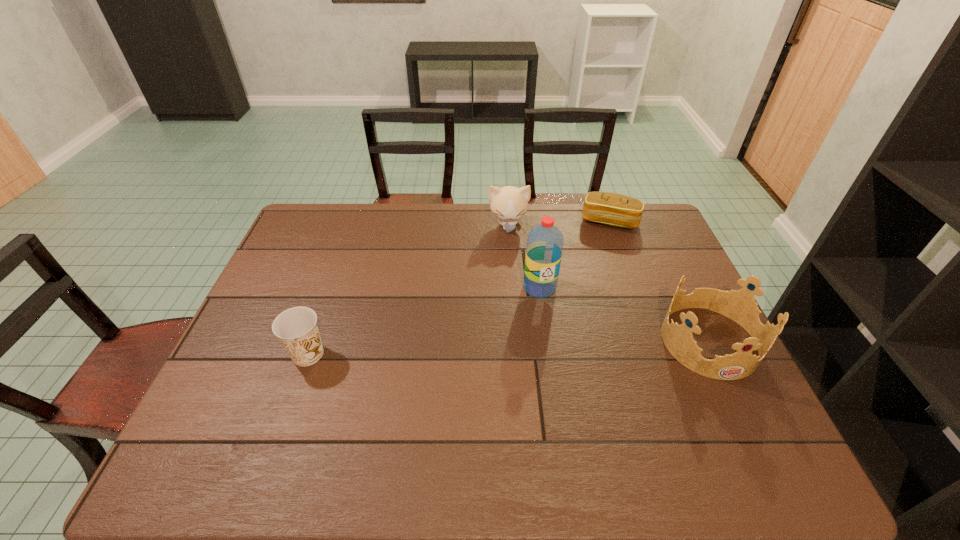
This screenshot has width=960, height=540. I want to click on object that is at the left edge, so click(x=297, y=329).

Where is `tiara present at the right edge`? This screenshot has height=540, width=960. tiara present at the right edge is located at coordinates (740, 306).

Locate an element on the screen. This screenshot has height=540, width=960. clutch bag that is at the right edge is located at coordinates (613, 209).

Identify the location of object at the far right corner. This screenshot has height=540, width=960. (613, 209).

I want to click on vacant space at the far edge of the desktop, so click(521, 237).

The height and width of the screenshot is (540, 960). I want to click on free space at the near edge, so click(474, 395).

This screenshot has width=960, height=540. In the image, there is a desktop. In order to click on vacant space at the far right corner in this screenshot , I will do `click(625, 232)`.

You are a GUI agent. You are given a task and a screenshot of the screen. Output one action in this format:
    pyautogui.click(x=<x>, y=<y>)
    Task: Click on the free spot between the shortest object and the Dixie cup
    The image size is (960, 540).
    Given the screenshot: What is the action you would take?
    pyautogui.click(x=459, y=288)

You are a GUI agent. You are given a task and a screenshot of the screen. Output one action in this format:
    pyautogui.click(x=<x>, y=<y>)
    Task: Click on the unoccupied area between the tallest object and the kitten
    The height and width of the screenshot is (540, 960).
    Given the screenshot: What is the action you would take?
    pyautogui.click(x=524, y=256)

I want to click on vacant area that lies between the second shortest object and the kitten, so click(x=408, y=289).